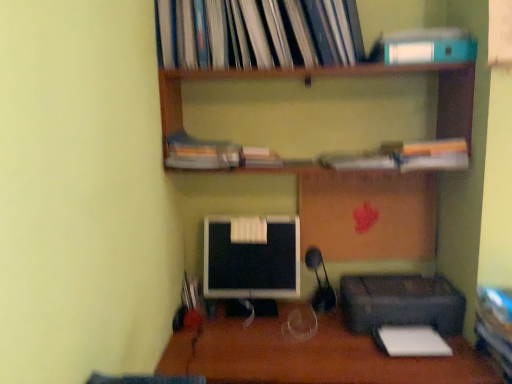
The height and width of the screenshot is (384, 512). Find the location of `empty space that is ontop of white paper at lower right (from a real-world perspective)`. empty space that is ontop of white paper at lower right (from a real-world perspective) is located at coordinates (419, 336).